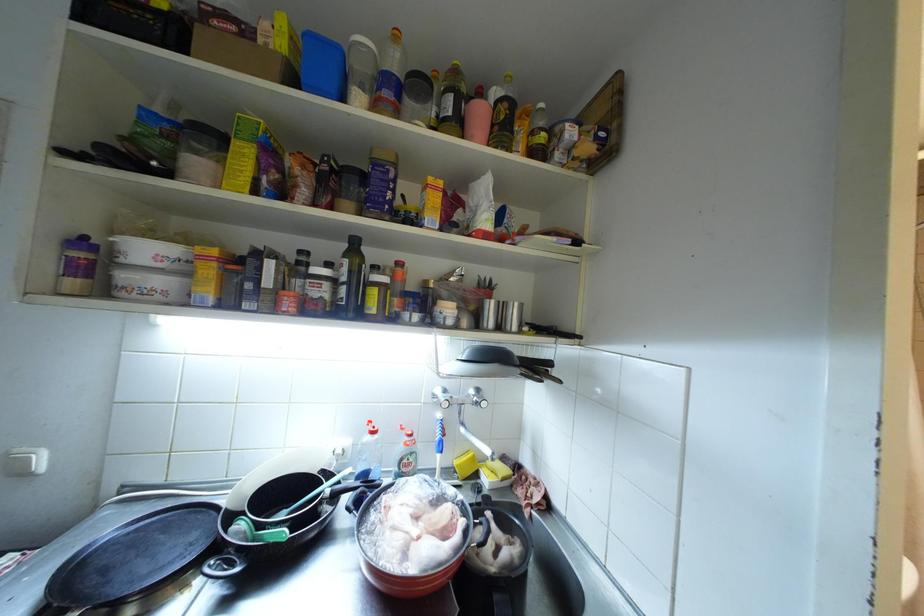
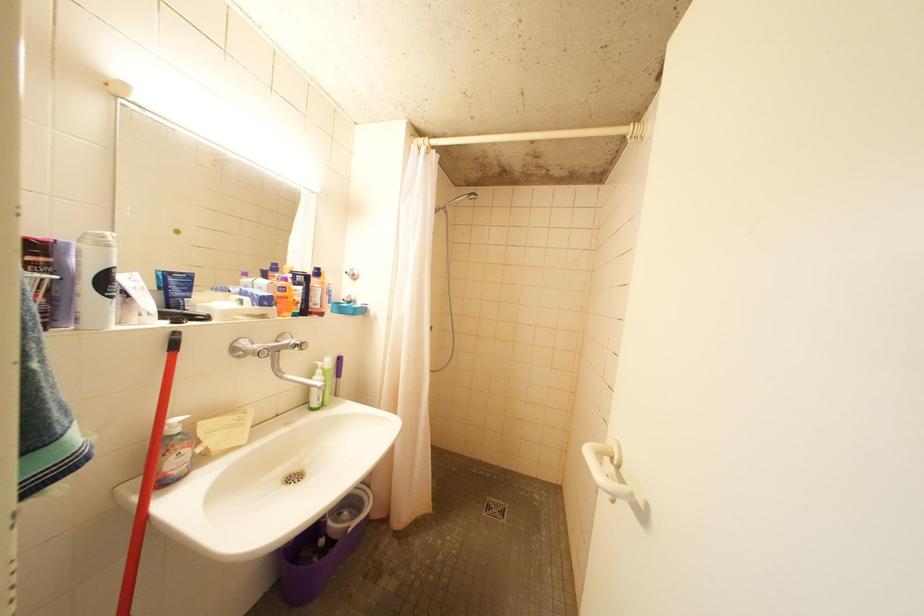
Question: The camera is either moving clockwise (left) or counter-clockwise (right) around the object. The first image is from the beginning of the video and the second image is from the end. Is the camera moving left or right when shooting the video?

Choices:
 (A) Left
 (B) Right

Answer: (A)